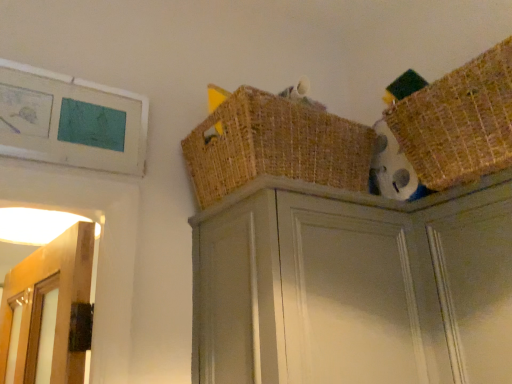
Image resolution: width=512 pixels, height=384 pixels. What do you see at coordinates (348, 284) in the screenshot?
I see `matte gray cabinet at upper center` at bounding box center [348, 284].

What is the approximate width of matte gray cabinet at upper center?

The width of matte gray cabinet at upper center is 13.28 inches.

Consider the image. How much space does woven brown basket at upper center, arranged as the 1th basket when viewed from the left, occupy vertically?

The height of woven brown basket at upper center, arranged as the 1th basket when viewed from the left, is 11.19 inches.

You are a GUI agent. You are given a task and a screenshot of the screen. Output one action in this format:
    pyautogui.click(x=<x>, y=<y>)
    Task: Click on the matte gray cabinet at upper center
    
    Given the screenshot: What is the action you would take?
    pyautogui.click(x=348, y=284)

From the picture: Does woven brown basket at upper center, the second basket viewed from the right, turn towards woven brown basket at upper right, which is counted as the 1th basket, starting from the right?

Yes, woven brown basket at upper center, the second basket viewed from the right, is facing woven brown basket at upper right, which is counted as the 1th basket, starting from the right.

How different are the orientations of woven brown basket at upper center, arranged as the 1th basket when viewed from the left, and woven brown basket at upper right, which is counted as the 1th basket, starting from the right, in degrees?

They differ by 90.7 degrees in their facing directions.

Is woven brown basket at upper center, arranged as the 1th basket when viewed from the left, spatially inside woven brown basket at upper right, which is counted as the 1th basket, starting from the right, or outside of it?

woven brown basket at upper center, arranged as the 1th basket when viewed from the left, lies outside woven brown basket at upper right, which is counted as the 1th basket, starting from the right.

Is woven brown basket at upper center, the second basket viewed from the right, to the left or to the right of woven brown basket at upper right, which is counted as the 1th basket, starting from the right, in the image?

In the image, woven brown basket at upper center, the second basket viewed from the right, appears on the left side of woven brown basket at upper right, which is counted as the 1th basket, starting from the right.

Could you tell me if matte gray cabinet at upper center is facing woven brown basket at upper center, the second basket viewed from the right?

No, matte gray cabinet at upper center is not turned towards woven brown basket at upper center, the second basket viewed from the right.

How many degrees apart are the facing directions of matte gray cabinet at upper center and woven brown basket at upper center, arranged as the 1th basket when viewed from the left?

The angle between the facing direction of matte gray cabinet at upper center and the facing direction of woven brown basket at upper center, arranged as the 1th basket when viewed from the left, is 0.786 degrees.

Looking at this image, considering the sizes of matte gray cabinet at upper center and woven brown basket at upper center, arranged as the 1th basket when viewed from the left, in the image, is matte gray cabinet at upper center wider or thinner than woven brown basket at upper center, arranged as the 1th basket when viewed from the left,?

Clearly, matte gray cabinet at upper center has more width compared to woven brown basket at upper center, arranged as the 1th basket when viewed from the left.

Does matte gray cabinet at upper center have a larger size compared to woven brown basket at upper center, the second basket viewed from the right?

Yes, matte gray cabinet at upper center is bigger than woven brown basket at upper center, the second basket viewed from the right.

In the scene shown: Does woven brown basket at upper right, which appears as the 2th basket when viewed from the left, turn towards woven brown basket at upper center, arranged as the 1th basket when viewed from the left?

No, woven brown basket at upper right, which appears as the 2th basket when viewed from the left, is not oriented towards woven brown basket at upper center, arranged as the 1th basket when viewed from the left.

Is woven brown basket at upper right, which appears as the 2th basket when viewed from the left, completely or partially outside of woven brown basket at upper center, the second basket viewed from the right?

Yes, woven brown basket at upper right, which appears as the 2th basket when viewed from the left, is not within woven brown basket at upper center, the second basket viewed from the right.

Which point is more distant from viewer, (490, 136) or (255, 131)?

Positioned behind is point (255, 131).

Between woven brown basket at upper right, which is counted as the 1th basket, starting from the right, and matte gray cabinet at upper center, which one has larger width?

matte gray cabinet at upper center is wider.

Who is taller, woven brown basket at upper right, which appears as the 2th basket when viewed from the left, or matte gray cabinet at upper center?

matte gray cabinet at upper center.

Based on their positions, is woven brown basket at upper right, which appears as the 2th basket when viewed from the left, located to the left or right of matte gray cabinet at upper center?

Based on their positions, woven brown basket at upper right, which appears as the 2th basket when viewed from the left, is located to the right of matte gray cabinet at upper center.

Is woven brown basket at upper right, which appears as the 2th basket when viewed from the left, inside matte gray cabinet at upper center?

No, matte gray cabinet at upper center does not contain woven brown basket at upper right, which appears as the 2th basket when viewed from the left.

Can you confirm if matte gray cabinet at upper center is positioned to the right of woven brown basket at upper right, which appears as the 2th basket when viewed from the left?

No.

How much distance is there between matte gray cabinet at upper center and woven brown basket at upper right, which appears as the 2th basket when viewed from the left?

matte gray cabinet at upper center and woven brown basket at upper right, which appears as the 2th basket when viewed from the left, are 9.68 inches apart from each other.

Could you tell me if matte gray cabinet at upper center is turned towards woven brown basket at upper right, which appears as the 2th basket when viewed from the left?

No, matte gray cabinet at upper center is not facing towards woven brown basket at upper right, which appears as the 2th basket when viewed from the left.

How distant is woven brown basket at upper center, arranged as the 1th basket when viewed from the left, from matte gray cabinet at upper center?

They are 7.53 inches apart.

From a real-world perspective, between woven brown basket at upper center, arranged as the 1th basket when viewed from the left, and matte gray cabinet at upper center, who is vertically lower?

matte gray cabinet at upper center.

From the image's perspective, does woven brown basket at upper center, arranged as the 1th basket when viewed from the left, appear higher than matte gray cabinet at upper center?

Correct, woven brown basket at upper center, arranged as the 1th basket when viewed from the left, appears higher than matte gray cabinet at upper center in the image.

Is point (187, 164) positioned after point (466, 247)?

Yes, it is.

Identify the location of basket below the woven brown basket at upper right, which appears as the 2th basket when viewed from the left (from the image's perspective). Image resolution: width=512 pixels, height=384 pixels. (274, 146).

At what (x,y) coordinates should I click in order to perform the action: click on the 1st basket above when counting from the matte gray cabinet at upper center (from the image's perspective). Please return your answer as a coordinate pair (x, y). The width and height of the screenshot is (512, 384). Looking at the image, I should click on (274, 146).

Looking at the image, which one is located closer to woven brown basket at upper center, the second basket viewed from the right, woven brown basket at upper right, which appears as the 2th basket when viewed from the left, or matte gray cabinet at upper center?

Among the two, matte gray cabinet at upper center is located nearer to woven brown basket at upper center, the second basket viewed from the right.

Considering their positions, is woven brown basket at upper center, the second basket viewed from the right, positioned closer to matte gray cabinet at upper center than woven brown basket at upper right, which is counted as the 1th basket, starting from the right?

The object closer to matte gray cabinet at upper center is woven brown basket at upper center, the second basket viewed from the right.

Which object lies nearer to the anchor point woven brown basket at upper center, the second basket viewed from the right, matte gray cabinet at upper center or woven brown basket at upper right, which is counted as the 1th basket, starting from the right?

matte gray cabinet at upper center is positioned closer to the anchor woven brown basket at upper center, the second basket viewed from the right.

Considering their positions, is matte gray cabinet at upper center positioned closer to woven brown basket at upper right, which appears as the 2th basket when viewed from the left, than woven brown basket at upper center, the second basket viewed from the right?

matte gray cabinet at upper center lies closer to woven brown basket at upper right, which appears as the 2th basket when viewed from the left, than the other object.

Estimate the real-world distances between objects in this image. Which object is further from woven brown basket at upper right, which is counted as the 1th basket, starting from the right, woven brown basket at upper center, arranged as the 1th basket when viewed from the left, or matte gray cabinet at upper center?

Among the two, woven brown basket at upper center, arranged as the 1th basket when viewed from the left, is located further to woven brown basket at upper right, which is counted as the 1th basket, starting from the right.

Estimate the real-world distances between objects in this image. Which object is closer to matte gray cabinet at upper center, woven brown basket at upper right, which is counted as the 1th basket, starting from the right, or woven brown basket at upper center, arranged as the 1th basket when viewed from the left?

woven brown basket at upper center, arranged as the 1th basket when viewed from the left, lies closer to matte gray cabinet at upper center than the other object.

The width and height of the screenshot is (512, 384). Identify the location of basket that lies between woven brown basket at upper right, which appears as the 2th basket when viewed from the left, and matte gray cabinet at upper center from top to bottom. (274, 146).